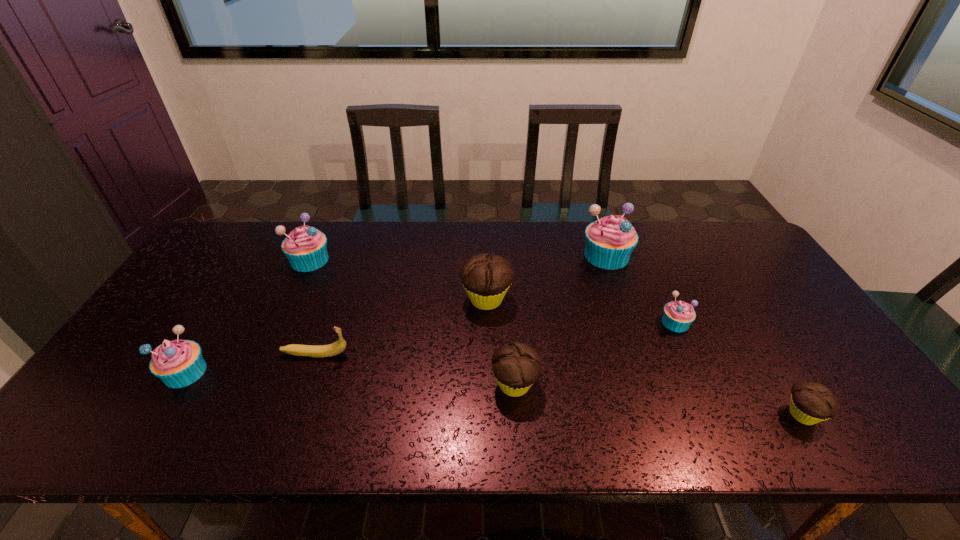
In order to click on object that stands as the seventh closest to the banana in this screenshot , I will do `click(811, 402)`.

Identify the location of the third closest muffin relative to the leftmost object. (516, 366).

Where is `the sixth closest muffin to the tallest muffin`? The width and height of the screenshot is (960, 540). the sixth closest muffin to the tallest muffin is located at coordinates pyautogui.click(x=178, y=363).

Identify which blue muffin is the nearest to the second blue muffin from left to right. Please provide its 2D coordinates. Your answer should be formatted as a tuple, i.e. [(x, y)], where the tuple contains the x and y coordinates of a point satisfying the conditions above.

[(178, 363)]

Locate an element on the screen. blue muffin object that ranks as the third closest to the rightmost blue muffin is located at coordinates (178, 363).

Identify which chocolate muffin is the second closest to the rightmost muffin. Please provide its 2D coordinates. Your answer should be formatted as a tuple, i.e. [(x, y)], where the tuple contains the x and y coordinates of a point satisfying the conditions above.

[(486, 278)]

The height and width of the screenshot is (540, 960). Identify the location of chocolate muffin that is the second closest to the third smallest blue muffin. (516, 366).

At what (x,y) coordinates should I click in order to perform the action: click on vacant space that satisfies the following two spatial constraints: 1. on the front side of the second blue muffin from left to right; 2. on the right side of the farthest chocolate muffin. Please return your answer as a coordinate pair (x, y). This screenshot has height=540, width=960. Looking at the image, I should click on (292, 299).

Find the location of a particular element. This screenshot has width=960, height=540. free location that satisfies the following two spatial constraints: 1. on the front side of the farthest chocolate muffin; 2. at the stem of the banana is located at coordinates (488, 354).